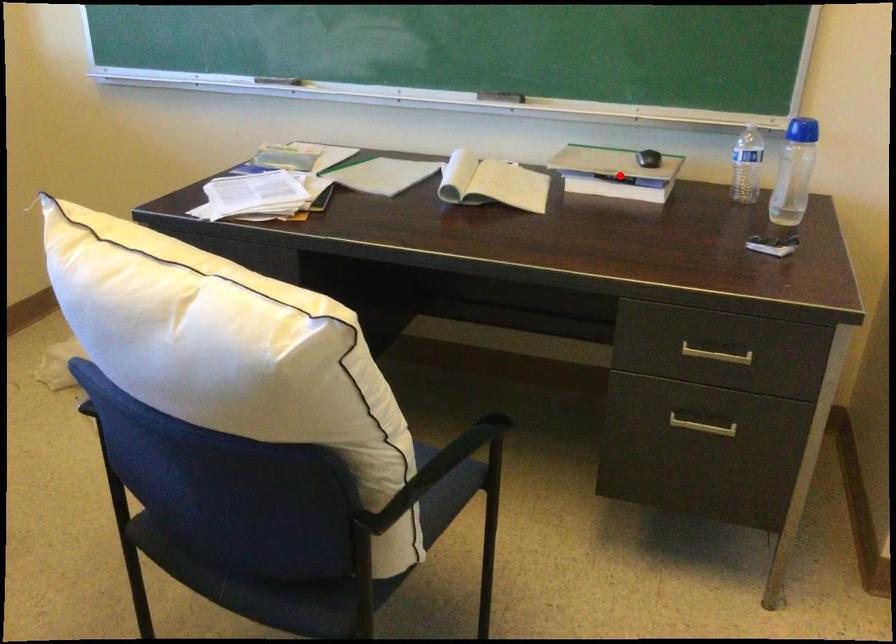
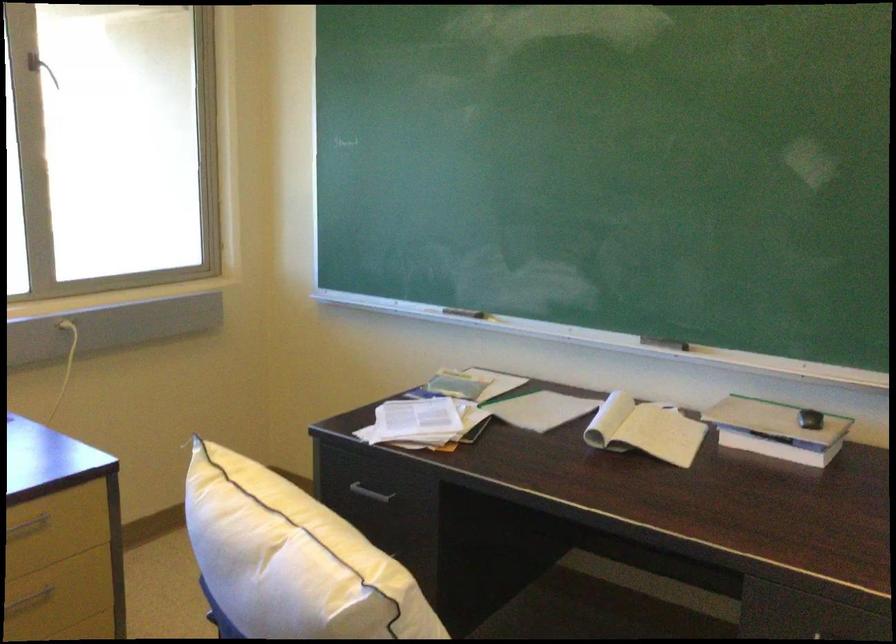
Locate, in the second image, the point that corresponds to the highlighted location in the first image.

(776, 430)